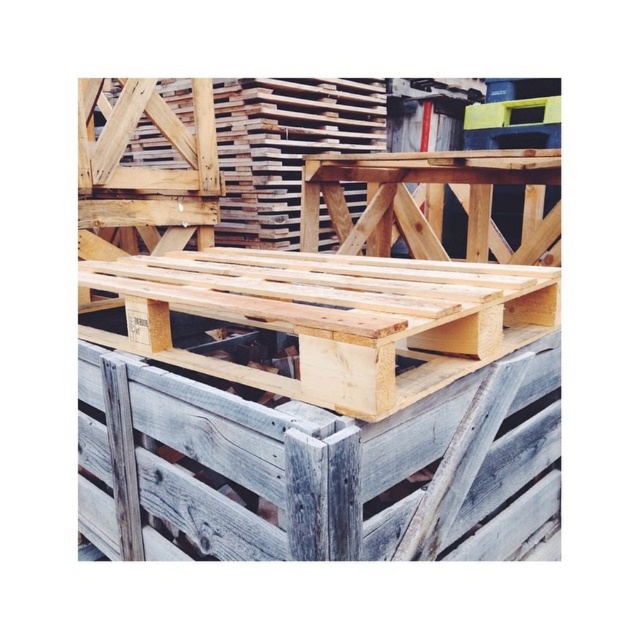
In the scene shown: You are a warehouse worker who needs to move the natural light wood pallet at center and the weathered gray wood at center. Which object requires more space to move due to its size?

The natural light wood pallet at center requires more space to move because it is bigger than the weathered gray wood at center.

You are an inspector checking the storage area. You notice the natural light wood pallet at center and the weathered gray wood at center. Which one is positioned higher in the scene?

The natural light wood pallet at center is above the weathered gray wood at center, so it is positioned higher.

You are standing in a storage area and see the point at coordinates (324, 388). What object is located at that point?

The point at coordinates (324, 388) indicates the natural light wood pallet at center.